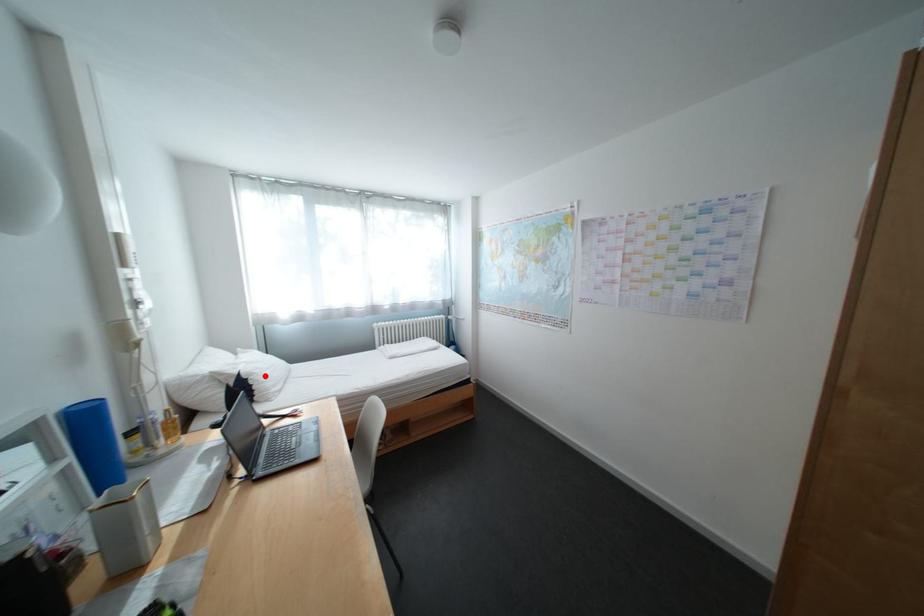
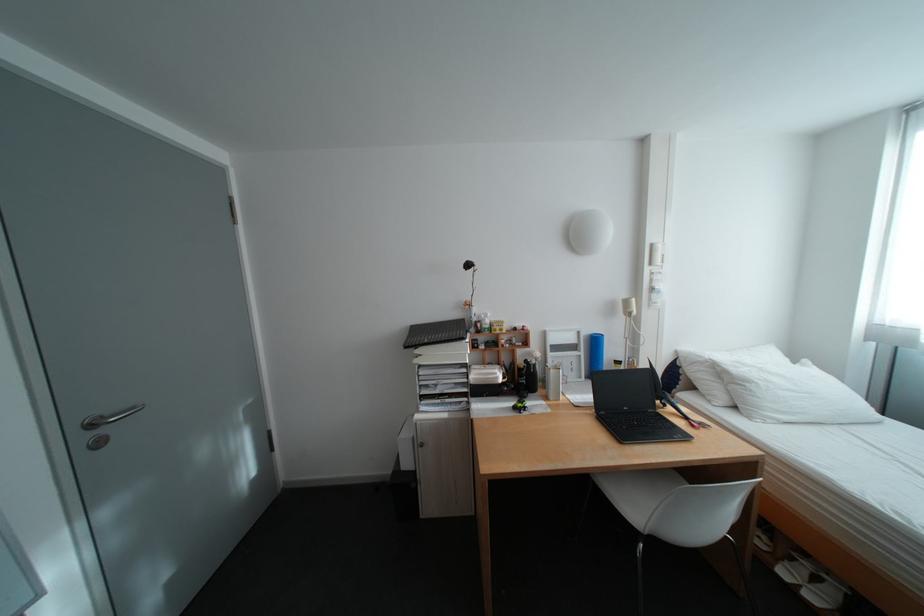
Question: I am providing you with two images of the same scene from different viewpoints. Given a red point in image1, look at the same physical point in image2. Is it:

Choices:
 (A) Closer to the viewpoint
 (B) Farther from the viewpoint

Answer: (B)